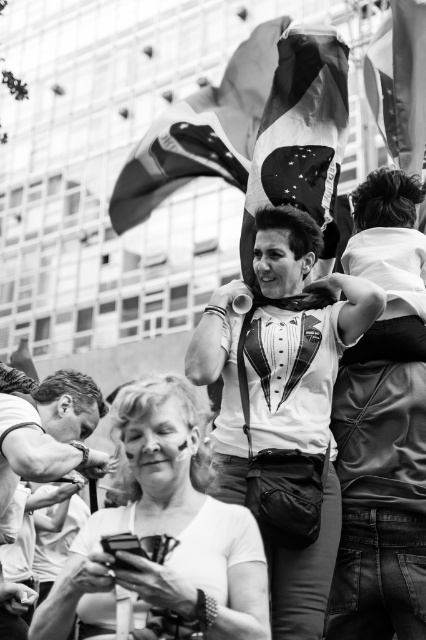
Question: Which point is closer to the camera?

Choices:
 (A) (287, 42)
 (B) (32, 456)

Answer: (B)

Question: Is white matte tuxedo shirt at center positioned at the back of printed fabric flag at center?

Choices:
 (A) no
 (B) yes

Answer: (A)

Question: Which point is closer to the camera?

Choices:
 (A) american flag at upper right
 (B) american flag at upper center

Answer: (B)

Question: Which object is positioned closest to the american flag at upper center?

Choices:
 (A) smooth leather watch at lower left
 (B) american flag at upper right
 (C) printed fabric flag at center

Answer: (C)

Question: Does white matte tuxedo shirt at center have a smaller size compared to american flag at upper right?

Choices:
 (A) yes
 (B) no

Answer: (B)

Question: Considering the relative positions of white matte tuxedo shirt at center and american flag at upper right in the image provided, where is white matte tuxedo shirt at center located with respect to american flag at upper right?

Choices:
 (A) right
 (B) left

Answer: (B)